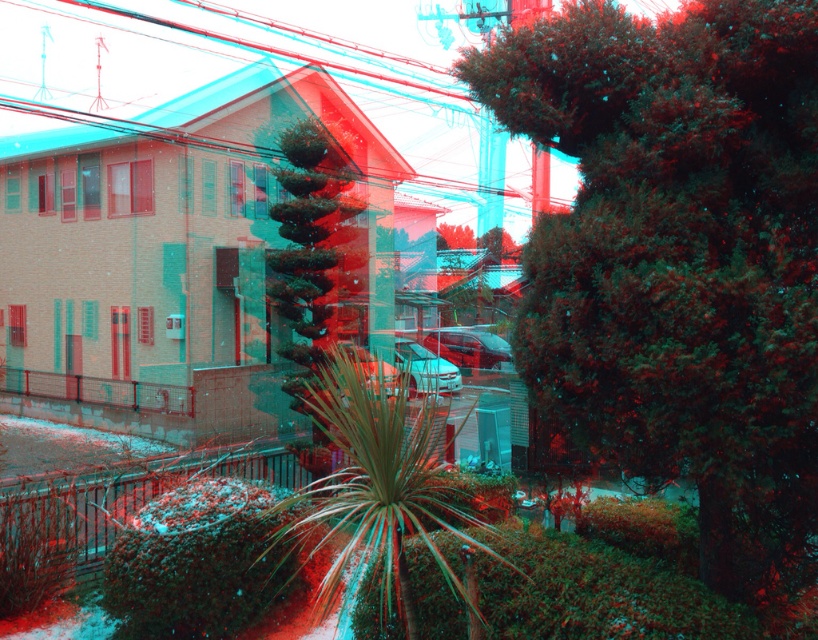
Can you confirm if green leafy plant at center is taller than green textured plant at center?

Indeed, green leafy plant at center has a greater height compared to green textured plant at center.

Can you confirm if green leafy plant at center is wider than green textured plant at center?

Yes.

Which is behind, point (434, 445) or point (281, 266)?

The point (281, 266) is more distant.

The image size is (818, 640). Find the location of `green leafy plant at center`. green leafy plant at center is located at coordinates (380, 488).

Can you confirm if green textured bush at center is shorter than green textured plant at center?

No, green textured bush at center is not shorter than green textured plant at center.

Does green textured bush at center appear on the right side of green textured plant at center?

Correct, you'll find green textured bush at center to the right of green textured plant at center.

The height and width of the screenshot is (640, 818). I want to click on green textured bush at center, so click(x=679, y=260).

At what (x,y) coordinates should I click in order to perform the action: click on green textured bush at center. Please return your answer as a coordinate pair (x, y). Looking at the image, I should click on (679, 260).

Who is positioned more to the left, green textured bush at center or green leafy plant at center?

green leafy plant at center is more to the left.

Between green textured bush at center and green leafy plant at center, which one appears on the right side from the viewer's perspective?

From the viewer's perspective, green textured bush at center appears more on the right side.

Who is more distant from viewer, [623,140] or [309,486]?

The point [309,486] is behind.

Locate an element on the screen. This screenshot has height=640, width=818. green textured bush at center is located at coordinates (679, 260).